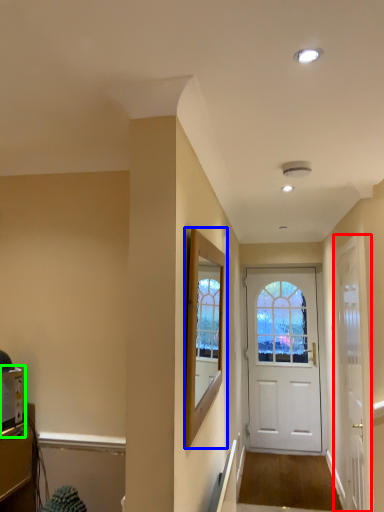
Question: Considering the real-world distances, which object is closest to door (highlighted by a red box)? window screen (highlighted by a blue box) or appliance (highlighted by a green box).

Choices:
 (A) window screen
 (B) appliance

Answer: (A)